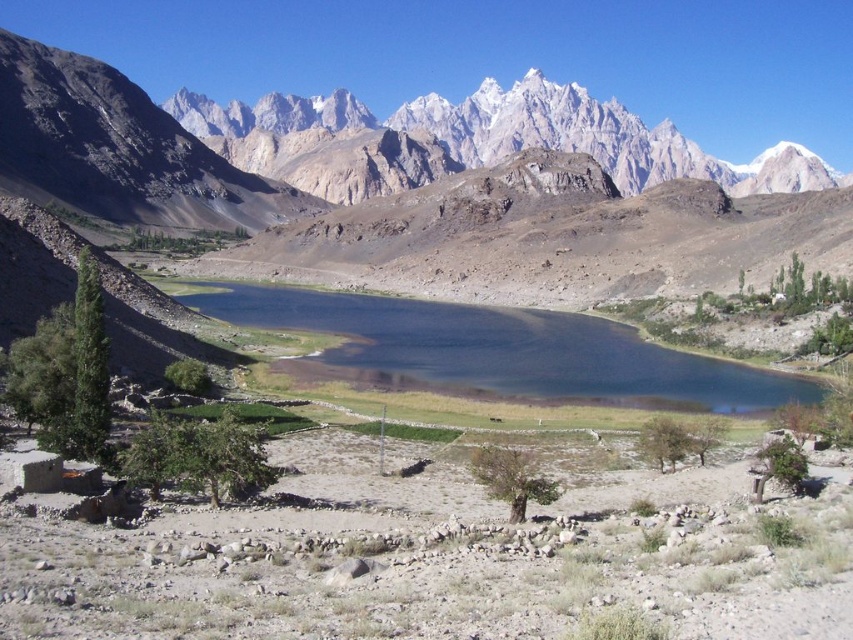
You are an explorer planning to cross the shiny blue water at center. You need to know if the white rocky mountain range at upper center is a visible landmark from the water. Based on the scene description, can you confirm if the mountain range is large enough to be seen from the lake?

The white rocky mountain range at upper center is larger in size than the shiny blue water at center, so yes, the mountain range would likely be visible from the lake as a prominent landmark.

You are standing at the edge of the lake in the mountainous landscape. You see two points marked in the scene. Which point is closer to you, point (170, 192) or point (514, 392)?

Point (170, 192) is closer to you because it is further to the viewer than point (514, 392).

You are planning to take a photo of the white rocky mountain range at upper center and the shiny blue water at center. Which object should you focus on first if you want to capture both in a single frame without moving the camera?

The white rocky mountain range at upper center might be wider than the shiny blue water at center, so you should focus on the wider object first to ensure it fits within the frame.